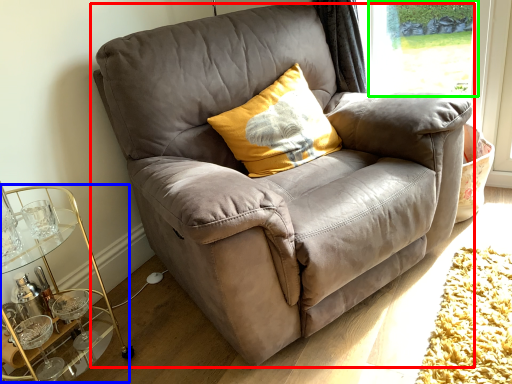
Question: Based on their relative distances, which object is farther from chair (highlighted by a red box)? Choose from cocktail table (highlighted by a blue box) and window screen (highlighted by a green box).

Choices:
 (A) cocktail table
 (B) window screen

Answer: (B)